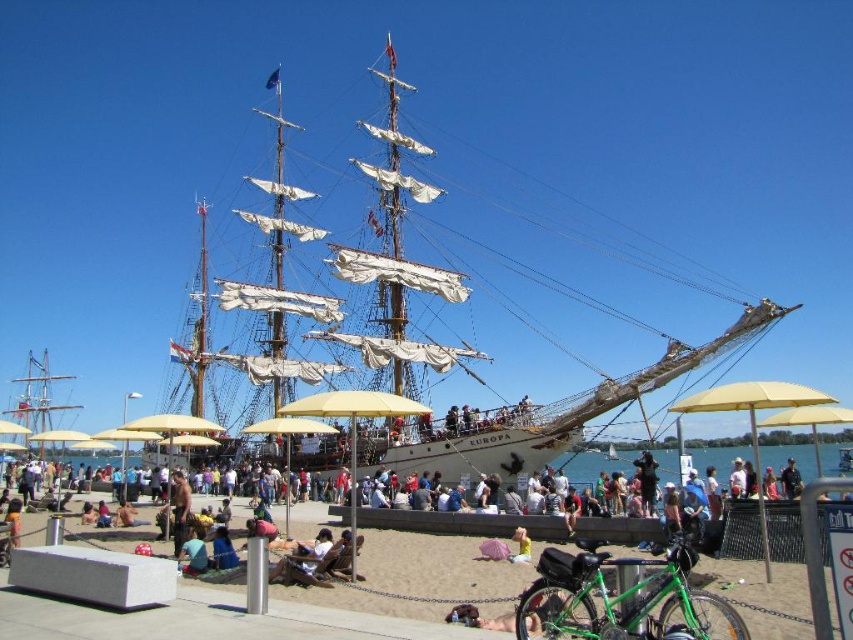
Based on the photo, you are standing at the point marked as point (659, 371) in the image. What object is directly in front of you?

The wooden ship at center is located at point (659, 371), so the wooden ship at center is directly in front of you.

You are standing on the sandy area near the yellow umbrellas and want to board the wooden ship at center. Which direction should you walk to reach the ship?

You should walk towards the center of the image to reach the wooden ship at center since it is located at point (659,371) in the frame.

You are a tourist standing on the sand at lower center and want to reach the yellow fabric umbrella at lower right. The path between them is straight. If you walk at a speed of 1.5 meters per second, how many seconds will it take you to reach the umbrella?

The distance between the sand at lower center and the yellow fabric umbrella at lower right is 43.61 meters. At a walking speed of 1.5 meters per second, dividing the distance by the speed gives 43.61 divided by 1.5, which equals approximately 29.07 seconds. Therefore, it will take about 29 seconds to reach the umbrella.